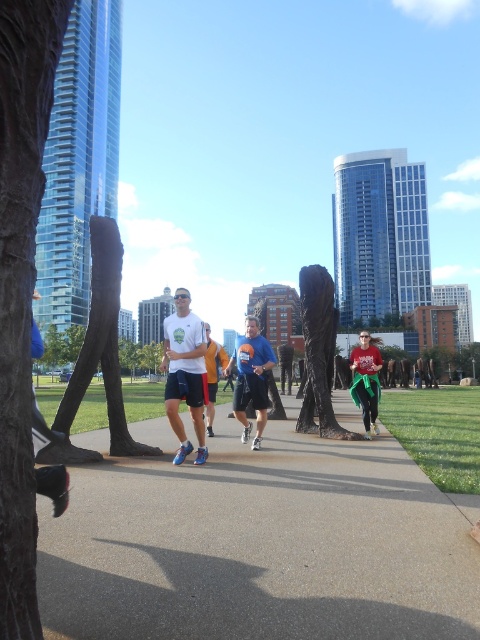
You are a photographer standing at the edge of the gray concrete sidewalk at center and want to capture the matte green skirt at center in your shot. Based on the scene, can you determine if the skirt is positioned above or below the sidewalk?

The gray concrete sidewalk at center is below the matte green skirt at center, so the skirt is positioned above the sidewalk.

You are a photographer standing at the edge of the gray concrete sidewalk at center and the matte green skirt at center is part of a person in the scene. Which object is nearer to you?

The gray concrete sidewalk at center is closer to the viewer than the matte green skirt at center.